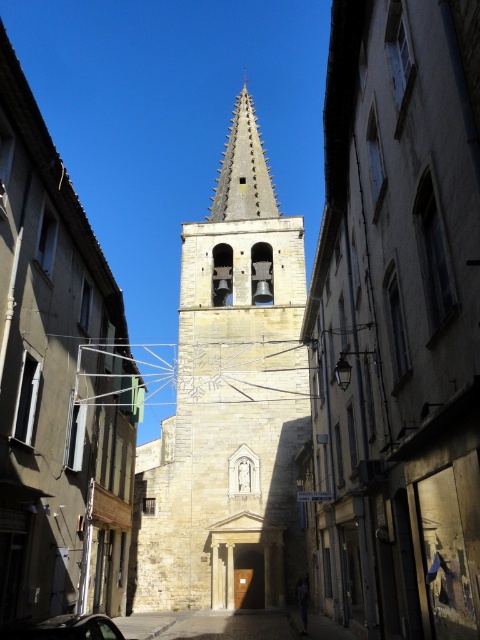
Question: Is stone bell tower at center in front of metallic car at center?

Choices:
 (A) no
 (B) yes

Answer: (A)

Question: Considering the relative positions of smooth stone spire at center and metallic car at center in the image provided, where is smooth stone spire at center located with respect to metallic car at center?

Choices:
 (A) left
 (B) right

Answer: (B)

Question: Which point appears closest to the camera in this image?

Choices:
 (A) (253, 113)
 (B) (159, 604)

Answer: (B)

Question: From the image, what is the correct spatial relationship of stone bell tower at center in relation to smooth stone spire at center?

Choices:
 (A) above
 (B) below

Answer: (B)

Question: Which of the following is the farthest from the observer?

Choices:
 (A) smooth stone spire at center
 (B) stone bell tower at center

Answer: (A)

Question: Which of the following is the closest to the observer?

Choices:
 (A) stone bell tower at center
 (B) metallic car at center
 (C) smooth stone spire at center

Answer: (B)